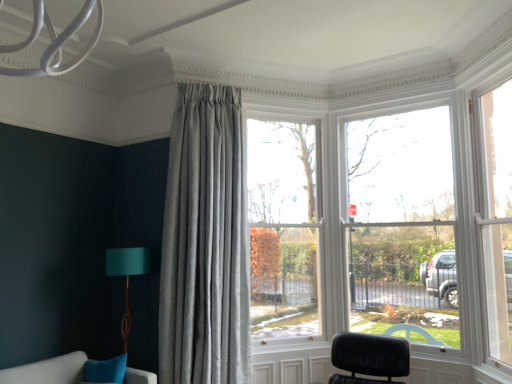
Question: Does clear glass window at center have a larger size compared to satin grey curtain at center?

Choices:
 (A) yes
 (B) no

Answer: (B)

Question: From the image's perspective, is clear glass window at center under satin grey curtain at center?

Choices:
 (A) no
 (B) yes

Answer: (A)

Question: Considering the relative sizes of clear glass window at center and satin grey curtain at center in the image provided, is clear glass window at center taller than satin grey curtain at center?

Choices:
 (A) no
 (B) yes

Answer: (A)

Question: Is clear glass window at center facing away from satin grey curtain at center?

Choices:
 (A) no
 (B) yes

Answer: (A)

Question: Would you say clear glass window at center is outside satin grey curtain at center?

Choices:
 (A) yes
 (B) no

Answer: (A)

Question: Is point (284, 137) closer or farther from the camera than point (138, 246)?

Choices:
 (A) farther
 (B) closer

Answer: (A)

Question: In the image, is clear glass window at center positioned in front of or behind teal fabric lampshade at lower left?

Choices:
 (A) behind
 (B) front

Answer: (A)

Question: From a real-world perspective, relative to teal fabric lampshade at lower left, is clear glass window at center vertically above or below?

Choices:
 (A) below
 (B) above

Answer: (B)

Question: Visually, is clear glass window at center positioned to the left or to the right of teal fabric lampshade at lower left?

Choices:
 (A) right
 (B) left

Answer: (A)

Question: Is teal fabric lampshade at lower left wider or thinner than satin grey curtain at center?

Choices:
 (A) wide
 (B) thin

Answer: (B)

Question: Which is correct: teal fabric lampshade at lower left is inside satin grey curtain at center, or outside of it?

Choices:
 (A) outside
 (B) inside

Answer: (A)

Question: From the image's perspective, is teal fabric lampshade at lower left above or below satin grey curtain at center?

Choices:
 (A) below
 (B) above

Answer: (A)

Question: Is teal fabric lampshade at lower left bigger or smaller than satin grey curtain at center?

Choices:
 (A) big
 (B) small

Answer: (B)

Question: Considering the positions of satin grey curtain at center and teal fabric lampshade at lower left in the image, is satin grey curtain at center bigger or smaller than teal fabric lampshade at lower left?

Choices:
 (A) small
 (B) big

Answer: (B)

Question: Considering the positions of satin grey curtain at center and teal fabric lampshade at lower left in the image, is satin grey curtain at center taller or shorter than teal fabric lampshade at lower left?

Choices:
 (A) short
 (B) tall

Answer: (B)